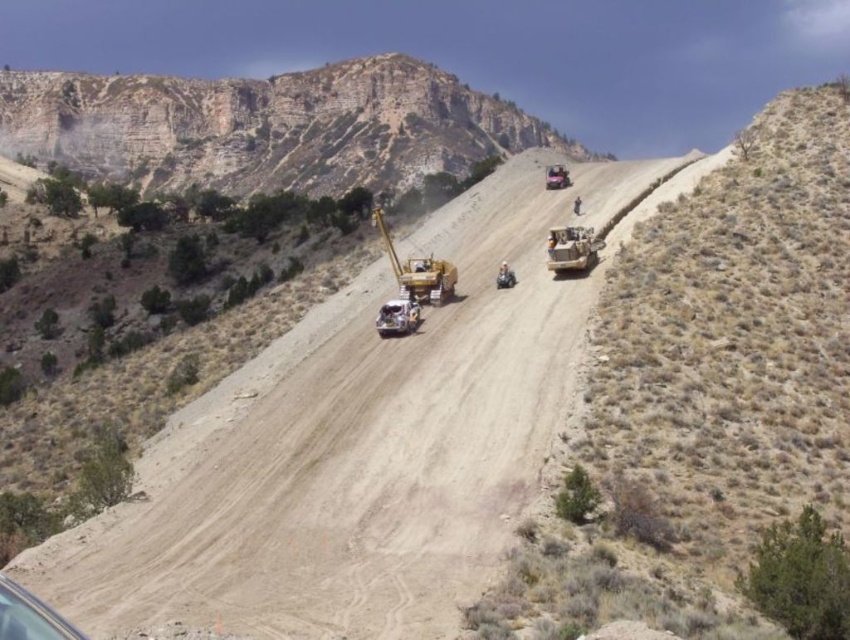
Based on the photo, you are a construction worker planning to move the metallic yellow truck at center closer to the rugged stone cliff at upper left. Based on their sizes, which object will occupy more space in the image after moving?

The rugged stone cliff at upper left will occupy more space in the image after moving because it has a larger size compared to the metallic yellow truck at center.

You are a construction supervisor overseeing the site shown in the image. You need to move the metallic yellow bulldozer at center to the loading zone located behind the rugged stone cliff at upper left. Is the bulldozer currently positioned in front of or behind the cliff?

The metallic yellow bulldozer at center is behind the rugged stone cliff at upper left, so it is already positioned behind the cliff and does not need to be moved further.

You are a surveyor assessing the construction site. You need to determine which object occupies more horizontal space. Which is wider, the rugged stone cliff at upper left or the transparent plastic car at lower left?

The rugged stone cliff at upper left is wider than the transparent plastic car at lower left according to the description.